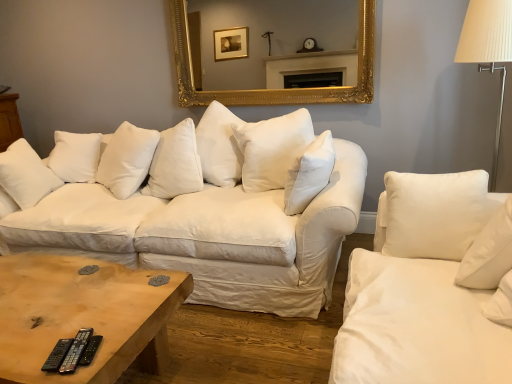
Where is `free space behind black rubber remote at lower left, arranged as the first remote when viewed from the left`? free space behind black rubber remote at lower left, arranged as the first remote when viewed from the left is located at coordinates (94, 314).